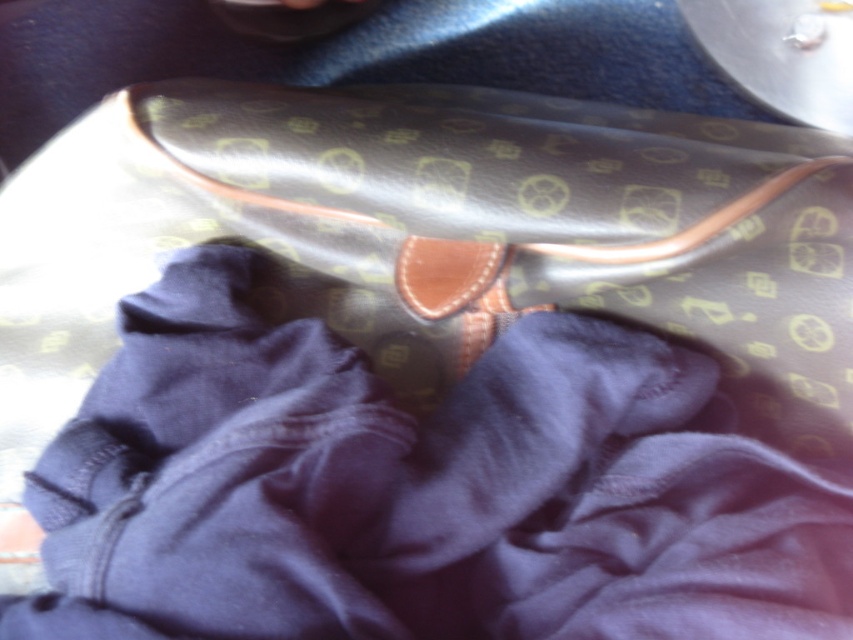
You are a fashion designer who wants to place a navy blue fabric at center on top of the leather bag at center. Is this possible without moving the existing items?

The navy blue fabric at center is currently below the leather bag at center, so you can lift the navy blue fabric at center and place it on top of the leather bag at center to achieve the desired arrangement.

You are trying to determine which item is closer to you in the image. You see the navy blue fabric at center and the leather bag at center. Which one is closer to your viewpoint?

The navy blue fabric at center is in front of the leather bag at center, so it is closer to your viewpoint.

You are trying to determine if the navy blue fabric at center can be placed over the leather bag at center without covering its bottom part. Based on their sizes, is this possible?

The navy blue fabric at center is shorter than the leather bag at center, so it can be placed over the bag without covering its bottom part since the fabric is shorter and won